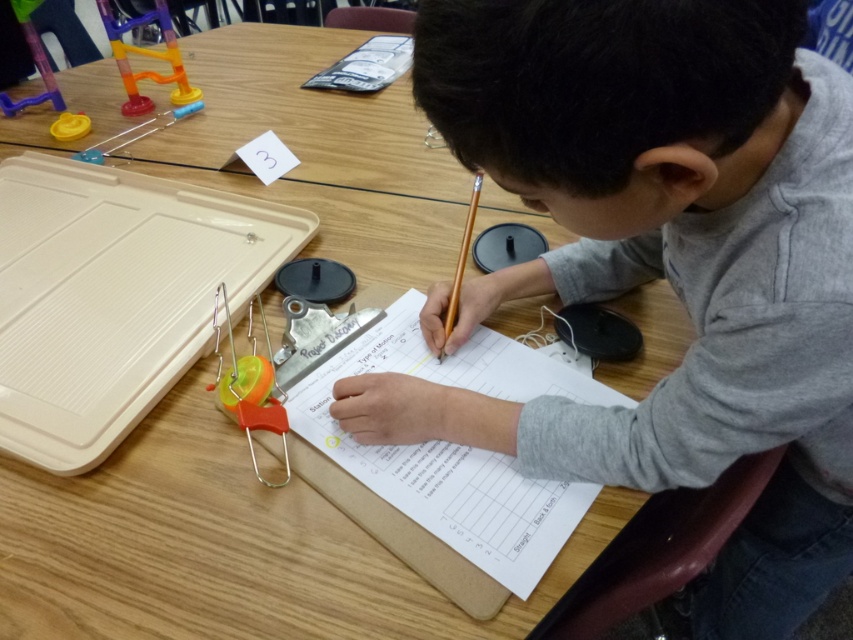
Can you confirm if gray cotton shirt at center is thinner than white paper at center?

Incorrect, gray cotton shirt at center's width is not less than white paper at center's.

Can you confirm if gray cotton shirt at center is shorter than white paper at center?

In fact, gray cotton shirt at center may be taller than white paper at center.

Does point (701, 593) come behind point (293, 428)?

Yes, point (701, 593) is behind point (293, 428).

I want to click on gray cotton shirt at center, so click(660, 260).